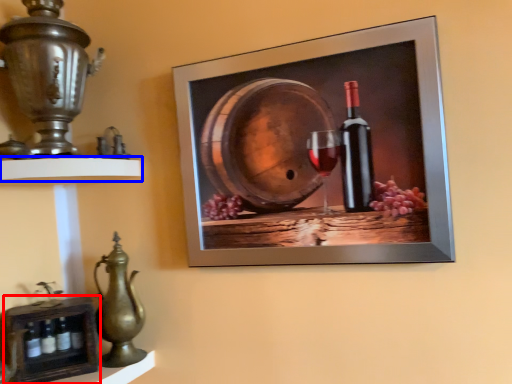
Question: Which object appears farthest to the camera in this image, shelf (highlighted by a red box) or shelf (highlighted by a blue box)?

Choices:
 (A) shelf
 (B) shelf

Answer: (A)